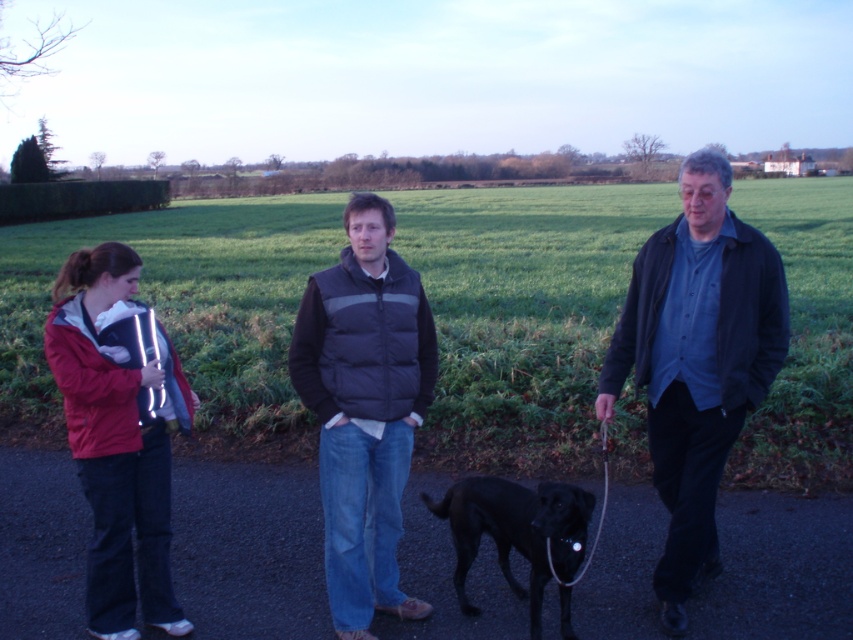
Who is more forward, (338,368) or (473,512)?

Point (338,368)

Is dark blue puffer vest at center further to the viewer compared to black smooth dog at center?

Yes, it is behind black smooth dog at center.

Which is in front, point (360, 611) or point (492, 524)?

Point (360, 611) is in front.

Locate an element on the screen. This screenshot has height=640, width=853. dark blue puffer vest at center is located at coordinates (364, 408).

Which is more to the right, black rubber dog leash at center or red fleece jacket at left?

From the viewer's perspective, black rubber dog leash at center appears more on the right side.

Does black rubber dog leash at center have a greater height compared to red fleece jacket at left?

No.

Find the location of a particular element. The image size is (853, 640). black rubber dog leash at center is located at coordinates (248, 548).

Can you confirm if red fleece jacket at left is shorter than black smooth dog at center?

No.

Does red fleece jacket at left lie in front of black smooth dog at center?

No, red fleece jacket at left is further to the viewer.

This screenshot has width=853, height=640. In order to click on red fleece jacket at left in this screenshot , I will do `click(115, 444)`.